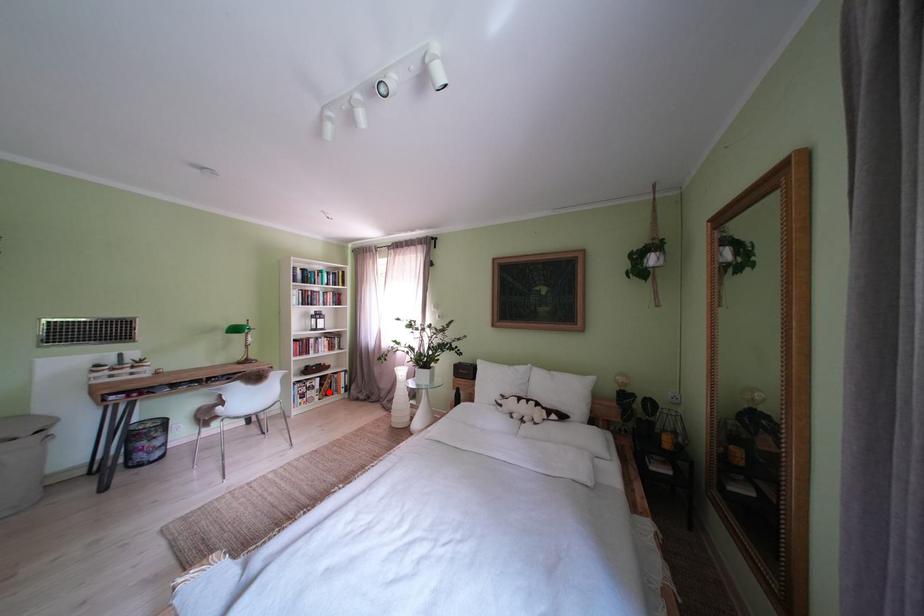
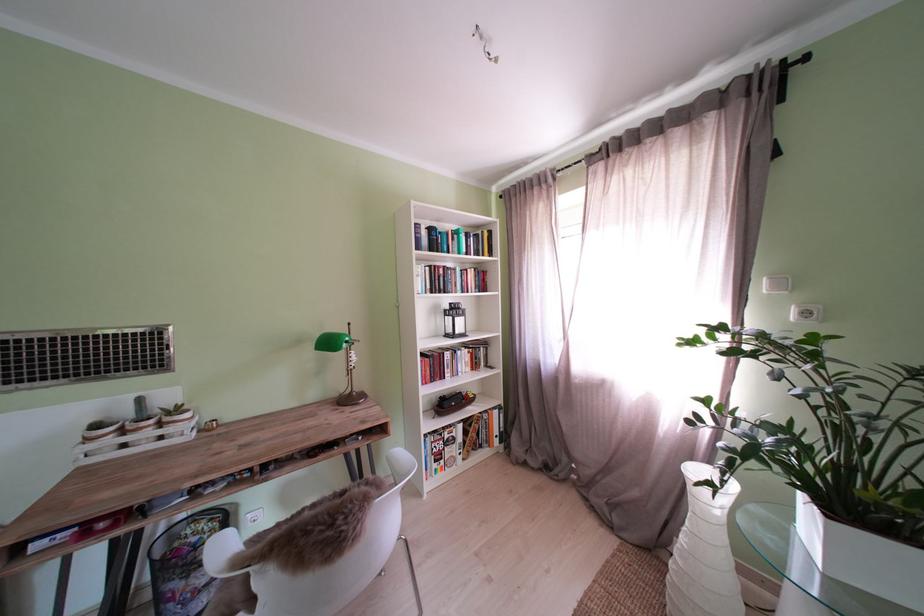
In the second image, find the point that corresponds to the highlighted location in the first image.

(470, 444)